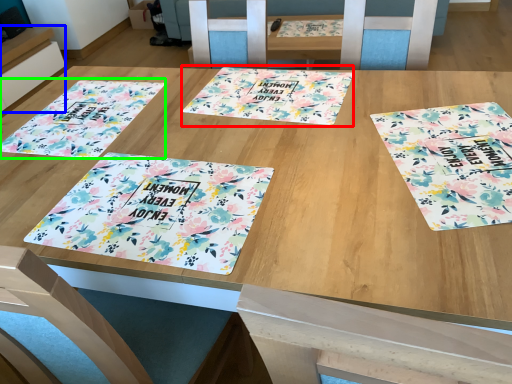
Question: Which object is the farthest from yoga mat (highlighted by a red box)? Choose among these: table (highlighted by a blue box) or tablecloth (highlighted by a green box).

Choices:
 (A) table
 (B) tablecloth

Answer: (A)